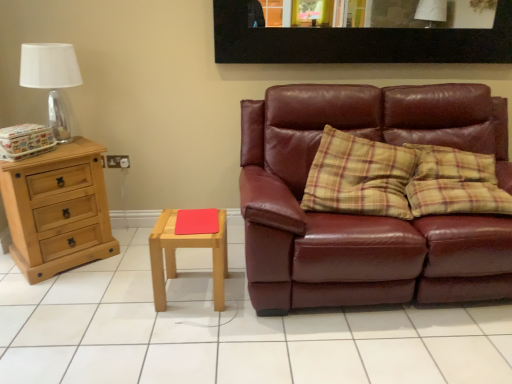
What do you see at coordinates (367, 216) in the screenshot? The image size is (512, 384). I see `matte leather couch at right` at bounding box center [367, 216].

Measure the distance between point [402,90] and camera.

The depth of point [402,90] is 7.94 feet.

This screenshot has height=384, width=512. Describe the element at coordinates (57, 209) in the screenshot. I see `natural wood chest of drawers at left` at that location.

Describe the element at coordinates (186, 247) in the screenshot. I see `light brown wooden stool at center` at that location.

Where is `white tile at center`? The image size is (512, 384). white tile at center is located at coordinates (229, 330).

Is white tile at center taller or shorter than light brown wooden stool at center?

white tile at center is shorter than light brown wooden stool at center.

How many degrees apart are the facing directions of white tile at center and light brown wooden stool at center?

The facing directions of white tile at center and light brown wooden stool at center are 1.26 degrees apart.

From the picture: Is white tile at center further to camera compared to light brown wooden stool at center?

No, it is not.

Would you say light brown wooden stool at center contains black matte picture frame at upper center?

No.

From the picture: From a real-world perspective, which object stands above the other?

black matte picture frame at upper center is physically above.

From the picture: Are light brown wooden stool at center and black matte picture frame at upper center located far from each other?

That's right, there is a large distance between light brown wooden stool at center and black matte picture frame at upper center.

Would you say transparent glass table lamp at upper left is outside black matte picture frame at upper center?

That's correct, transparent glass table lamp at upper left is outside of black matte picture frame at upper center.

From a real-world perspective, which is physically below, transparent glass table lamp at upper left or black matte picture frame at upper center?

transparent glass table lamp at upper left.

Is transparent glass table lamp at upper left thinner than black matte picture frame at upper center?

No.

Locate an element on the screen. The image size is (512, 384). table lamp that appears below the black matte picture frame at upper center (from the image's perspective) is located at coordinates (51, 79).

Is point (469, 366) in front of point (66, 137)?

That is True.

Where is `tile directly beneath the transparent glass table lamp at upper left (from a real-world perspective)`? tile directly beneath the transparent glass table lamp at upper left (from a real-world perspective) is located at coordinates (229, 330).

Can you see white tile at center touching transparent glass table lamp at upper left?

Answer: No, white tile at center is not in contact with transparent glass table lamp at upper left.

Can you confirm if white tile at center is bigger than transparent glass table lamp at upper left?

Correct, white tile at center is larger in size than transparent glass table lamp at upper left.

How distant is matte leather couch at right from light brown wooden stool at center?

matte leather couch at right and light brown wooden stool at center are 26.50 inches apart from each other.

Is matte leather couch at right further to the viewer compared to light brown wooden stool at center?

That is False.

Looking at their sizes, would you say matte leather couch at right is wider or thinner than light brown wooden stool at center?

Considering their sizes, matte leather couch at right looks broader than light brown wooden stool at center.

Is matte leather couch at right to the right of light brown wooden stool at center from the viewer's perspective?

Yes.

Who is smaller, light brown wooden stool at center or transparent glass table lamp at upper left?

light brown wooden stool at center.

From a real-world perspective, which object rests below the other?

light brown wooden stool at center is physically lower.

Consider the image. From the image's perspective, which one is positioned higher, light brown wooden stool at center or transparent glass table lamp at upper left?

transparent glass table lamp at upper left.

From a real-world perspective, is matte leather couch at right below transparent glass table lamp at upper left?

Correct, in the physical world, matte leather couch at right is lower than transparent glass table lamp at upper left.

Can you confirm if matte leather couch at right is thinner than transparent glass table lamp at upper left?

No, matte leather couch at right is not thinner than transparent glass table lamp at upper left.

Consider the image. Between matte leather couch at right and transparent glass table lamp at upper left, which one has smaller size?

transparent glass table lamp at upper left.

From the image's perspective, which is above, matte leather couch at right or transparent glass table lamp at upper left?

transparent glass table lamp at upper left.

The width and height of the screenshot is (512, 384). Find the location of `nightstand above the white tile at center (from a real-world perspective)`. nightstand above the white tile at center (from a real-world perspective) is located at coordinates [186, 247].

The width and height of the screenshot is (512, 384). What are the coordinates of `picture frame behind the light brown wooden stool at center` in the screenshot? It's located at (356, 41).

Looking at the image, which one is located further to black matte picture frame at upper center, white tile at center or matte leather couch at right?

Based on the image, white tile at center appears to be further to black matte picture frame at upper center.

Which object lies nearer to the anchor point natural wood chest of drawers at left, black matte picture frame at upper center or matte leather couch at right?

matte leather couch at right is positioned closer to the anchor natural wood chest of drawers at left.

Considering their positions, is transparent glass table lamp at upper left positioned further to light brown wooden stool at center than black matte picture frame at upper center?

black matte picture frame at upper center.

Estimate the real-world distances between objects in this image. Which object is further from matte leather couch at right, black matte picture frame at upper center or light brown wooden stool at center?

Based on the image, black matte picture frame at upper center appears to be further to matte leather couch at right.

Which object lies further to the anchor point light brown wooden stool at center, matte leather couch at right or black matte picture frame at upper center?

Among the two, black matte picture frame at upper center is located further to light brown wooden stool at center.

Considering their positions, is natural wood chest of drawers at left positioned closer to light brown wooden stool at center than white tile at center?

white tile at center is closer to light brown wooden stool at center.

When comparing their distances from white tile at center, does light brown wooden stool at center or transparent glass table lamp at upper left seem further?

transparent glass table lamp at upper left is positioned further to the anchor white tile at center.

Based on their spatial positions, is white tile at center or transparent glass table lamp at upper left further from natural wood chest of drawers at left?

Based on the image, white tile at center appears to be further to natural wood chest of drawers at left.

Image resolution: width=512 pixels, height=384 pixels. Identify the location of studio couch between black matte picture frame at upper center and white tile at center in the vertical direction. (367, 216).

This screenshot has width=512, height=384. In order to click on tile located between light brown wooden stool at center and matte leather couch at right in the left-right direction in this screenshot , I will do `click(229, 330)`.

Where is `nightstand between natural wood chest of drawers at left and black matte picture frame at upper center from left to right`? The width and height of the screenshot is (512, 384). nightstand between natural wood chest of drawers at left and black matte picture frame at upper center from left to right is located at coordinates (186, 247).

At what (x,y) coordinates should I click in order to perform the action: click on tile situated between natural wood chest of drawers at left and matte leather couch at right from left to right. Please return your answer as a coordinate pair (x, y). Looking at the image, I should click on (229, 330).